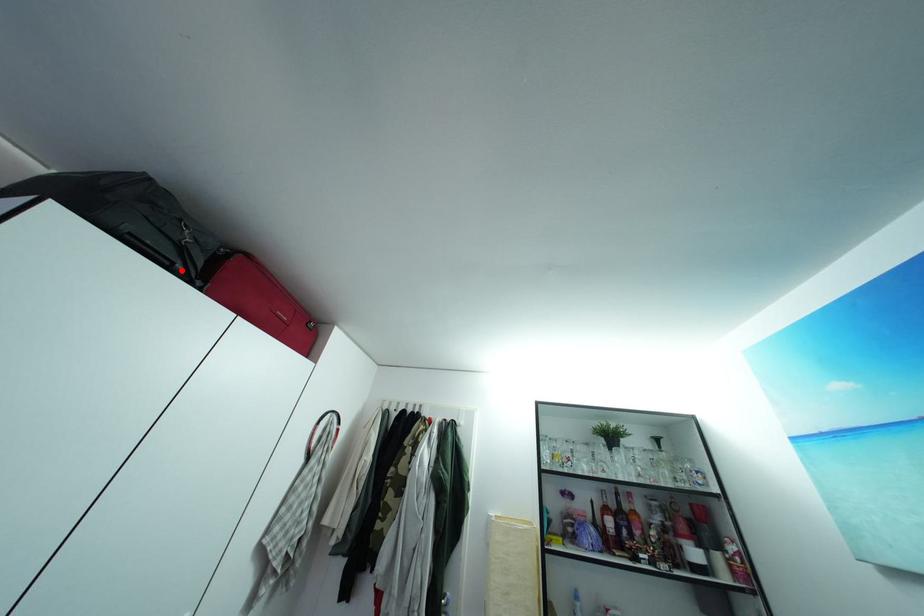
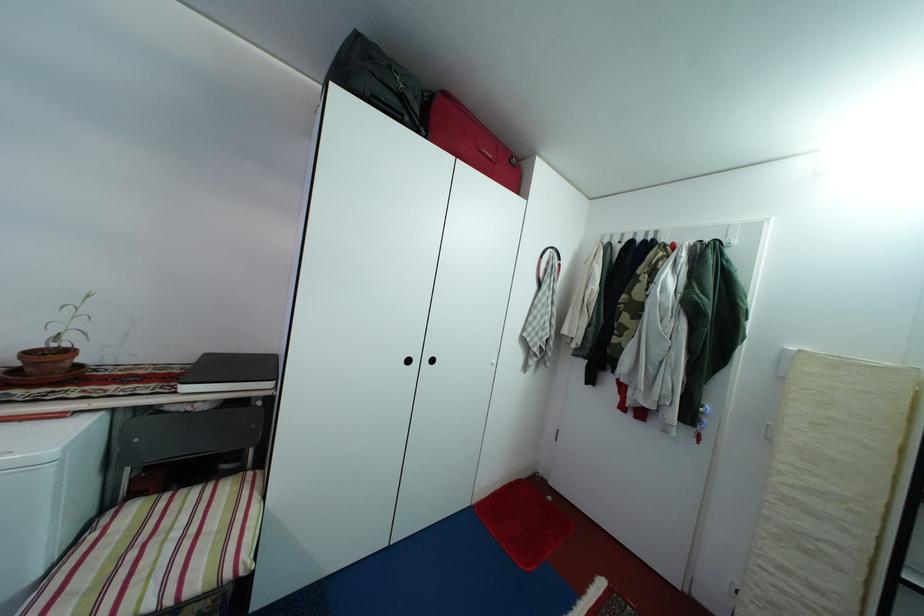
Locate, in the second image, the point that corresponds to the highlighted location in the first image.

(410, 123)